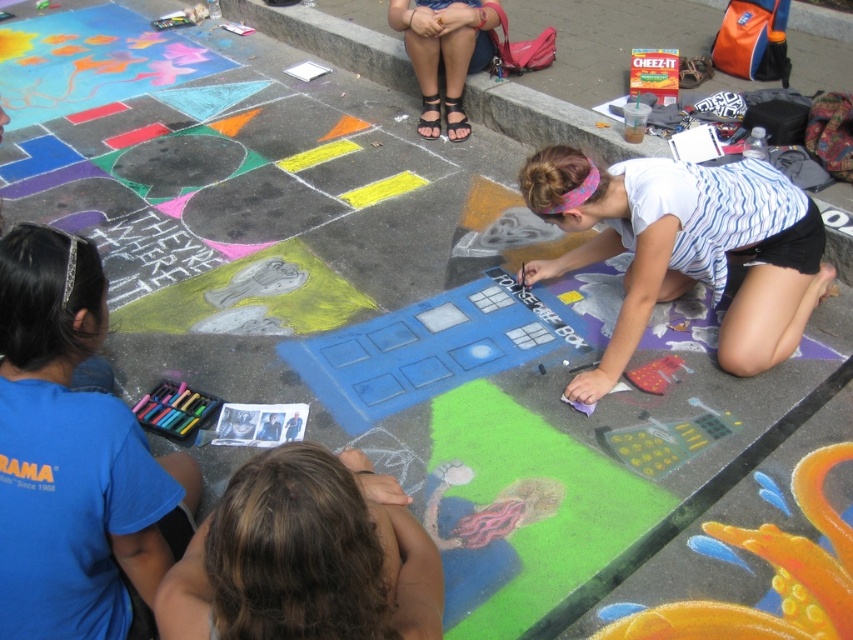
Question: Among these objects, which one is farthest from the camera?

Choices:
 (A) brown hair at lower left
 (B) white striped shirt at lower right

Answer: (B)

Question: In this image, where is blue fabric shirt at lower left located relative to white striped shirt at lower right?

Choices:
 (A) left
 (B) right

Answer: (A)

Question: Which point is farther from the camera taking this photo?

Choices:
 (A) (711, 234)
 (B) (461, 22)

Answer: (B)

Question: Is blue fabric shirt at lower left to the left of white striped shirt at lower right from the viewer's perspective?

Choices:
 (A) yes
 (B) no

Answer: (A)

Question: In this image, where is white striped shirt at lower right located relative to brown hair at lower left?

Choices:
 (A) above
 (B) below

Answer: (A)

Question: Among these objects, which one is nearest to the camera?

Choices:
 (A) blue fabric shirt at lower left
 (B) matte black sandals at upper center

Answer: (A)